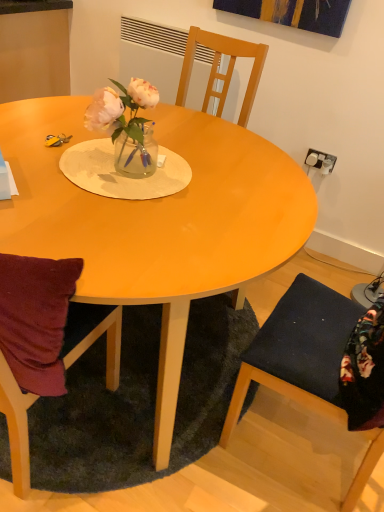
Locate an element on the screen. free location to the right of translucent glass vase at center is located at coordinates (193, 180).